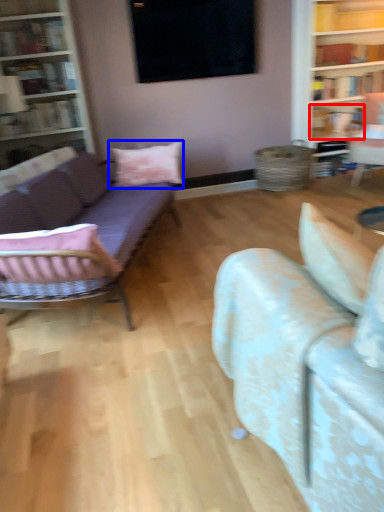
Question: Which of the following is the farthest to the observer, book (highlighted by a red box) or pillow (highlighted by a blue box)?

Choices:
 (A) book
 (B) pillow

Answer: (A)